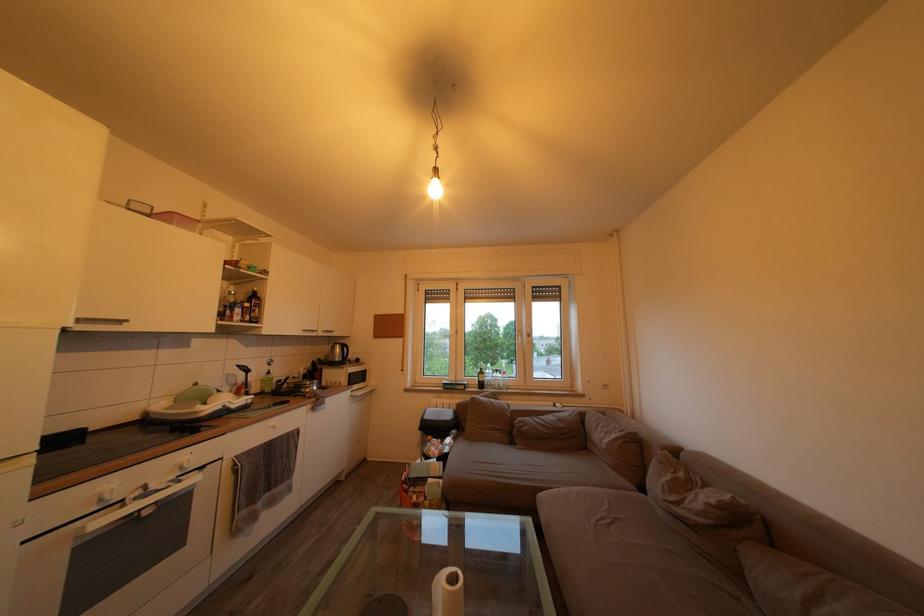
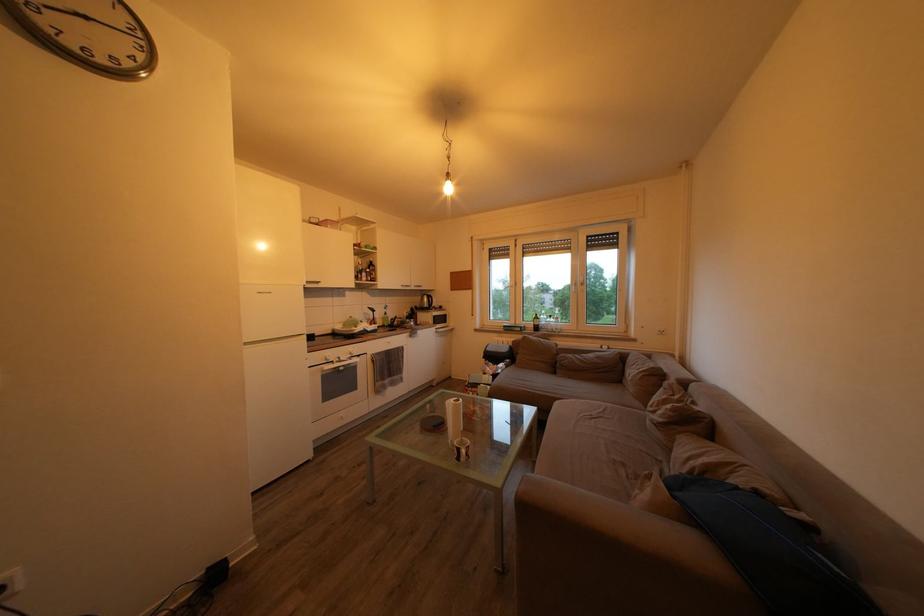
Where in the second image is the point corresponding to (678,505) from the first image?

(659, 416)